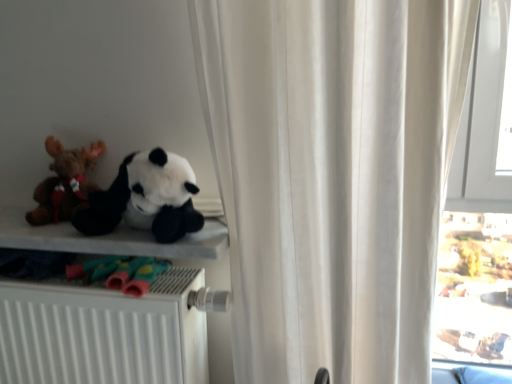
Image resolution: width=512 pixels, height=384 pixels. I want to click on free space above white matte radiator at lower left (from a real-world perspective), so click(95, 273).